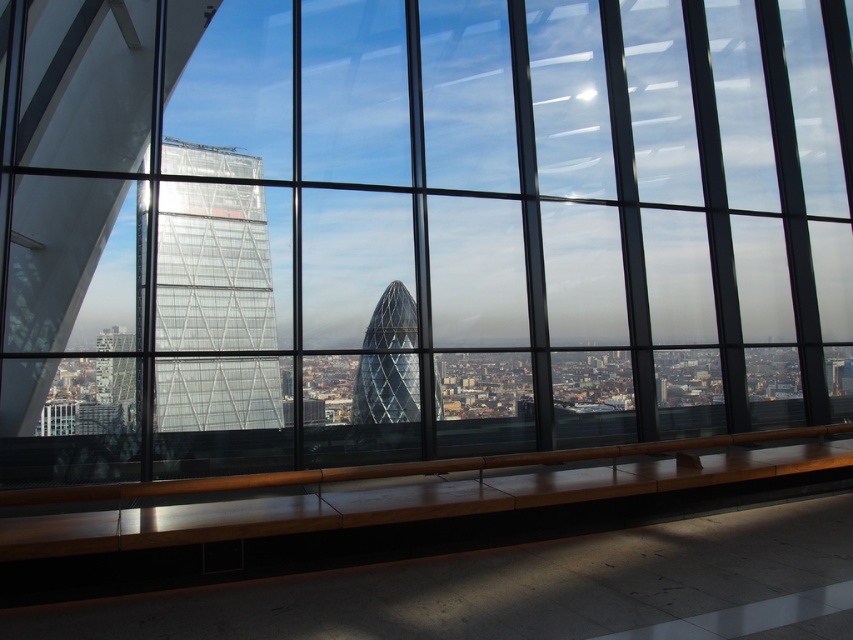
You are standing inside the modern building and looking through the large windows. There are two points marked on the window glass, one at coordinates point (213, 278) and the other at point (372, 400). If you want to touch the point that is nearer to you, which coordinate should you aim for?

Point (213, 278) is closer to the viewer than point (372, 400), so you should aim for point (213, 278).

You are an architect planning to install a new light fixture between the transparent glass tower at left and the glassy steel tower at center. Based on their positions, which tower should the light be closer to if you want it to be equidistant from both?

The light fixture should be placed exactly halfway between the transparent glass tower at left and the glassy steel tower at center to ensure equal distance from both.